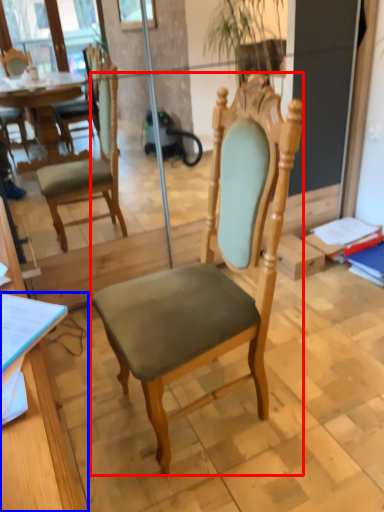
Question: Among these objects, which one is farthest to the camera, chair (highlighted by a red box) or desk (highlighted by a blue box)?

Choices:
 (A) chair
 (B) desk

Answer: (A)